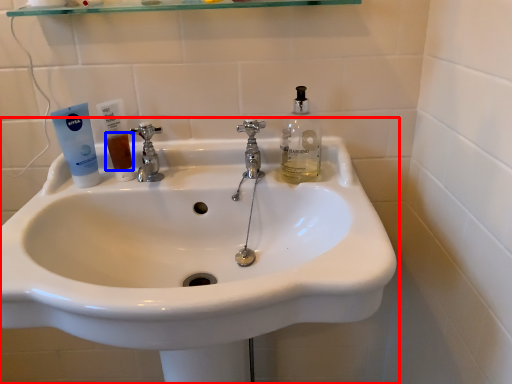
Question: Which object is closer to the camera taking this photo, sink (highlighted by a red box) or liquid (highlighted by a blue box)?

Choices:
 (A) sink
 (B) liquid

Answer: (A)